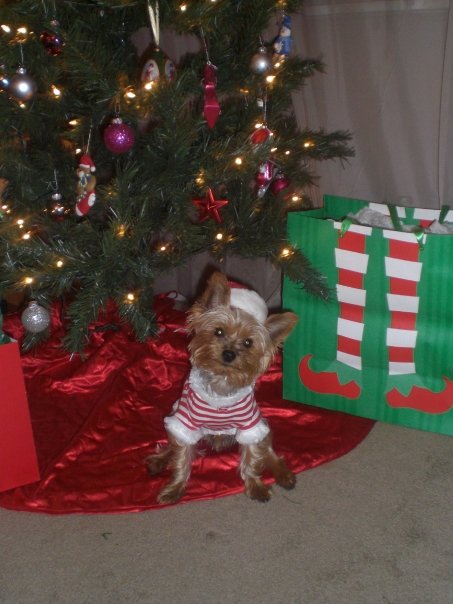
Find the location of a particular element. The image size is (453, 604). gift bags is located at coordinates (32, 467), (344, 378).